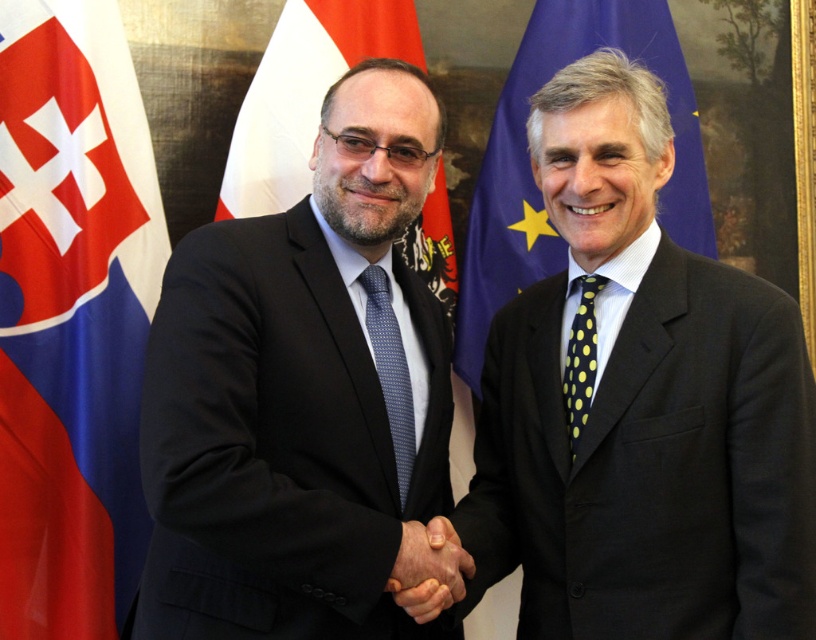
Question: Estimate the real-world distances between objects in this image. Which object is closer to the blue fabric flag at upper right?

Choices:
 (A) blue dotted tie at center
 (B) white fabric flag at upper center

Answer: (B)

Question: Is white fabric flag at upper center behind yellow dotted tie at right?

Choices:
 (A) yes
 (B) no

Answer: (A)

Question: Considering the real-world distances, which object is closest to the white fabric flag at upper center?

Choices:
 (A) dark gray suit at center
 (B) smooth skin handshake at center
 (C) black suit at center

Answer: (C)

Question: Among these points, which one is nearest to the camera?

Choices:
 (A) (415, 618)
 (B) (408, 440)

Answer: (A)

Question: Is dark gray suit at center positioned before red fabric flag at left?

Choices:
 (A) yes
 (B) no

Answer: (A)

Question: Can you confirm if dark gray suit at center is positioned to the left of white fabric flag at upper center?

Choices:
 (A) yes
 (B) no

Answer: (B)